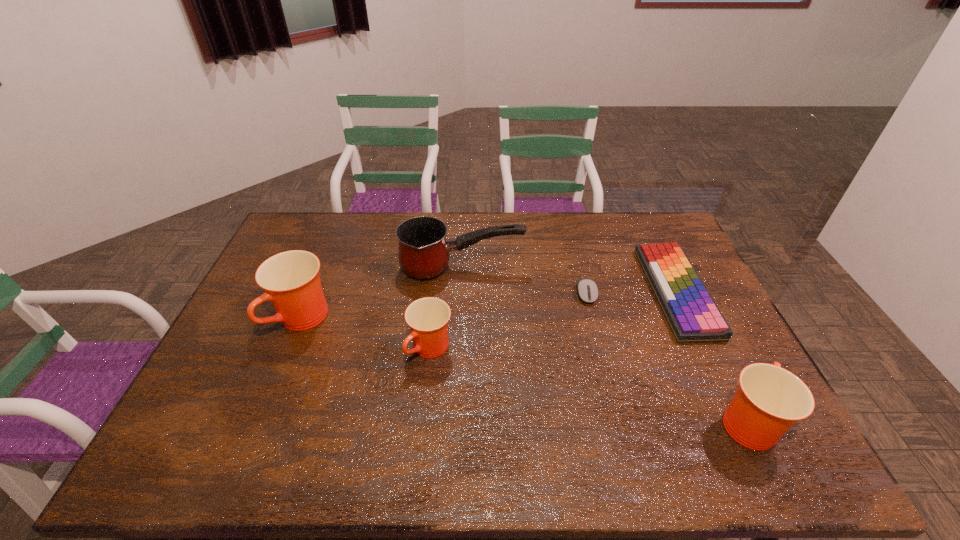
Identify the location of the leftmost cup. (291, 280).

The height and width of the screenshot is (540, 960). I want to click on the shortest cup, so click(428, 317).

Identify the location of the third shortest object. Image resolution: width=960 pixels, height=540 pixels. (428, 317).

Locate an element on the screen. Image resolution: width=960 pixels, height=540 pixels. the nearest cup is located at coordinates (769, 400).

Find the location of a particular element. the second shortest cup is located at coordinates (769, 400).

The image size is (960, 540). I want to click on saucepan, so click(x=424, y=251).

Find the location of `the fifth tallest object`. the fifth tallest object is located at coordinates (690, 311).

You are a GUI agent. You are given a task and a screenshot of the screen. Output one action in this format:
    pyautogui.click(x=<x>, y=<y>)
    Task: Click on the fourth object from left to right
    
    Given the screenshot: What is the action you would take?
    pyautogui.click(x=587, y=289)

In order to click on computer equipment in this screenshot , I will do `click(587, 289)`.

Find the location of `free space located on the back of the leftmost object`. free space located on the back of the leftmost object is located at coordinates (329, 254).